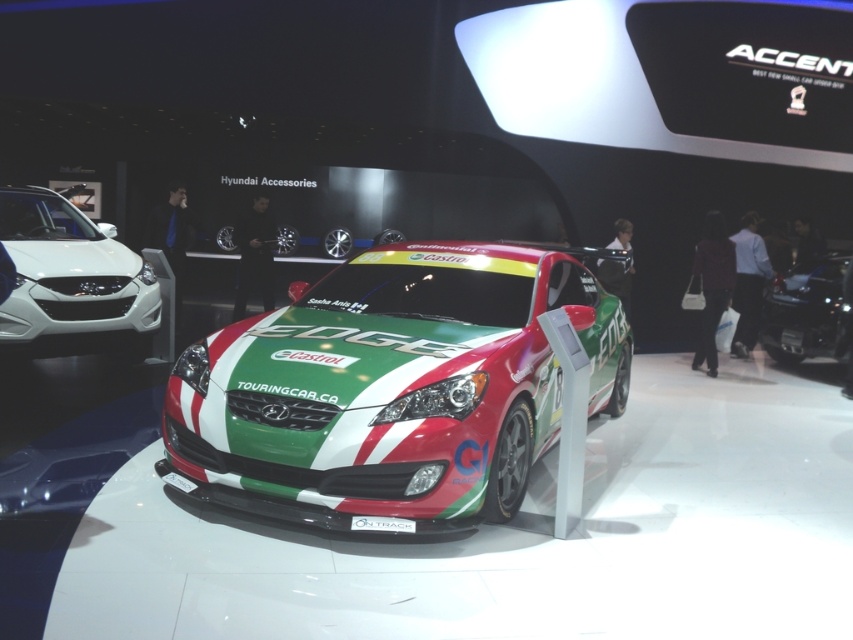
You are a photographer at the auto show and need to capture the white glossy sedan at left and the white plastic license plate at center in a single frame. Given that your camera has a fixed focal length, which object should you position closer to the camera to ensure both fit in the frame?

Since the white glossy sedan at left is wider than the white plastic license plate at center, you should position the white glossy sedan at left closer to the camera. This will make it appear smaller in the frame, allowing both objects to fit within the camera view.

In the scene shown: You are a photographer at the auto show and want to take a clear photo of the white plastic license plate at center without the shiny metallic race car at center blocking it. Is this possible given their positions?

The white plastic license plate at center is behind the shiny metallic race car at center, so it is blocked by the car and cannot be seen clearly in the photo.

You are a photographer at the auto show and need to capture the shiny metallic race car at center and the white plastic license plate at center in a single shot. Given that your camera can only focus on objects within a 2 meter width, will both objects fit within the frame?

The shiny metallic race car at center is wider than the white plastic license plate at center. Since the camera can focus on objects within a 2 meter width, but the exact width of the race car is not provided, it is uncertain if both will fit. However, if the race car is wider than 2 meters, it might not fit entirely within the frame.